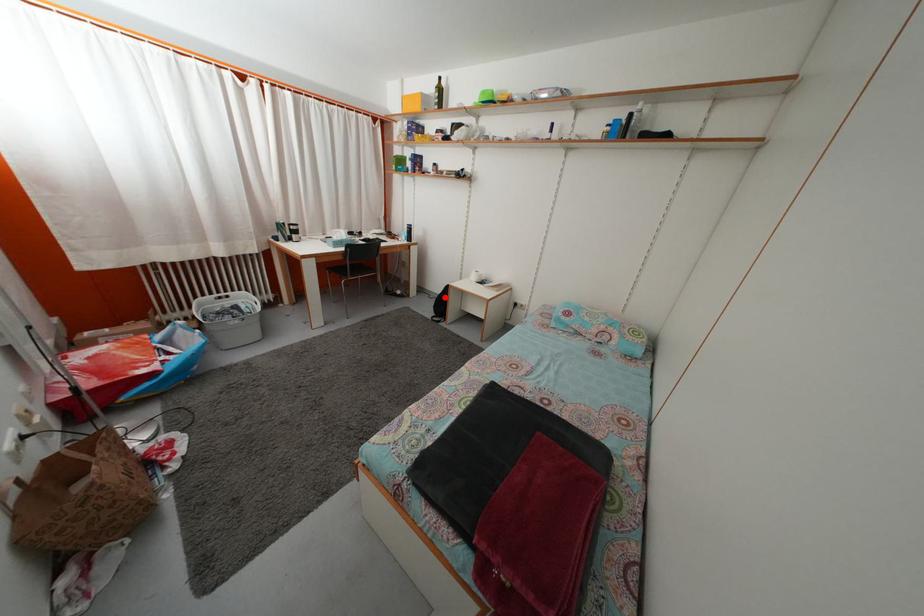
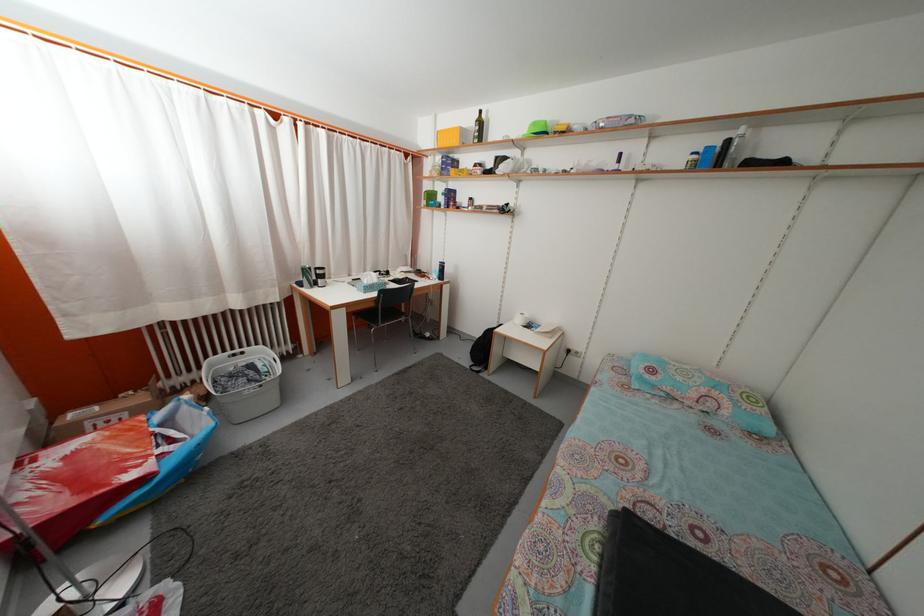
Question: I am providing you with two images of the same scene from different viewpoints. Image1 has a red point marked. In image2, the corresponding 3D location appears at what relative position? Reply with the corresponding letter.

Choices:
 (A) Closer
 (B) Farther

Answer: (B)